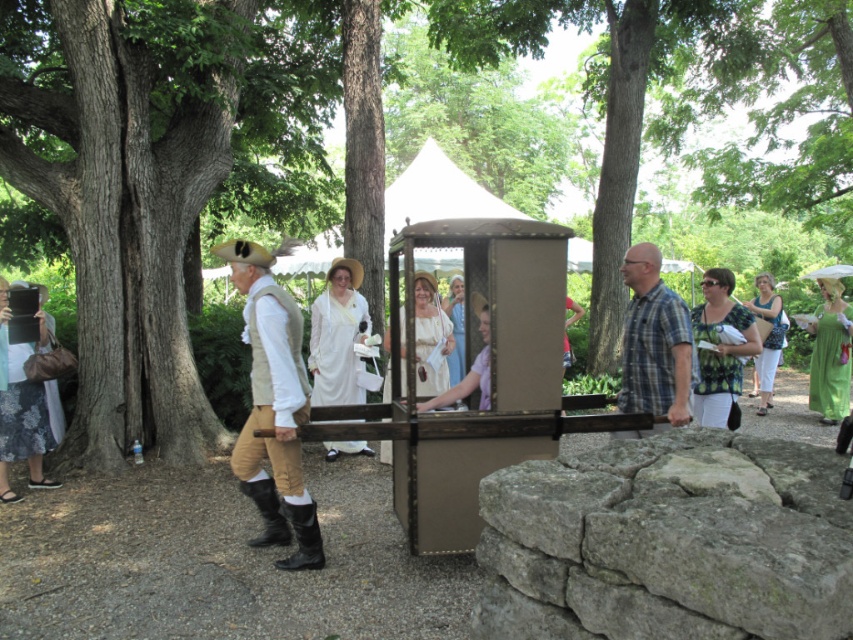
You are a photographer trying to capture a photo of both the green printed blouse at center and the green cotton dress at right. Since you want them both in focus, you need to know their positions relative to each other. Which one is positioned to the left?

The green printed blouse at center is positioned to the left of the green cotton dress at right.

You are a painter setting up your easel in the park. You want to capture both the brown rough tree trunk at center and the blue plaid shirt at center in your painting. Which object should you place closer to the center of your canvas to ensure it stands out more?

The brown rough tree trunk at center is larger in size than the blue plaid shirt at center, so you should place the brown rough tree trunk at center closer to the center of your canvas to ensure it stands out more.